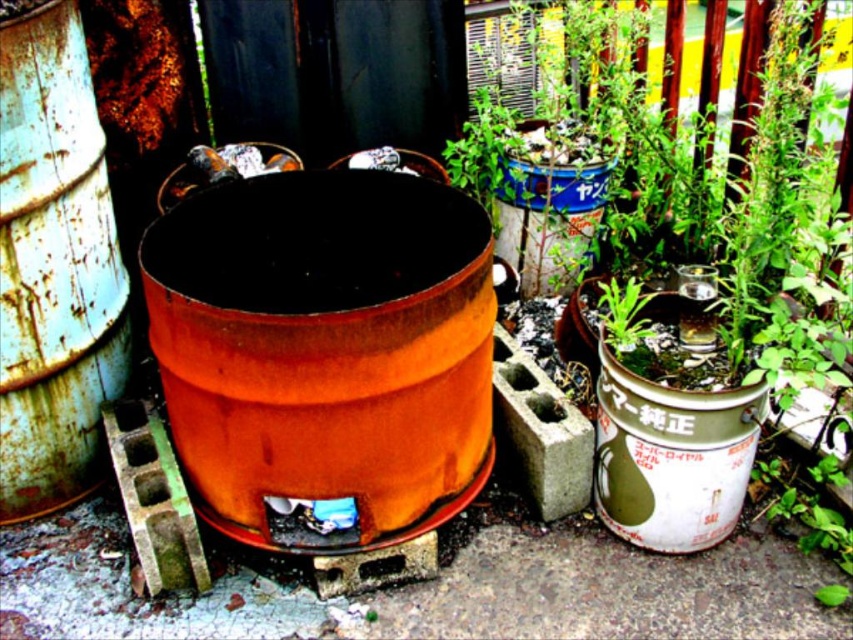
What are the coordinates of the green matte plant at center?

The green matte plant at center is located at coordinates point (x=741, y=188).